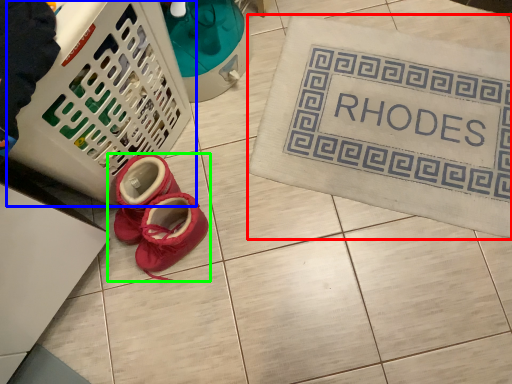
Question: Which is nearer to the bath mat (highlighted by a red box)? basket (highlighted by a blue box) or footwear (highlighted by a green box).

Choices:
 (A) basket
 (B) footwear

Answer: (B)